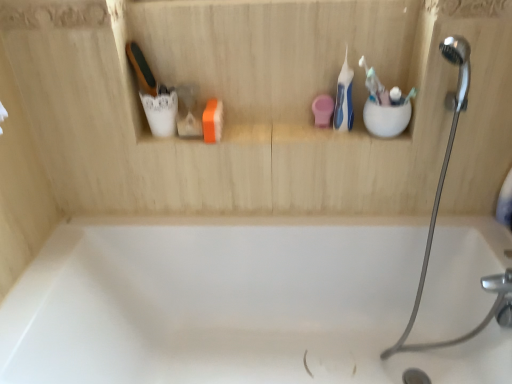
Image resolution: width=512 pixels, height=384 pixels. What are the coordinates of `blank space to the left of blue plastic toothbrush at upper right, arranged as the 3th toothbrush when viewed from the right` in the screenshot? It's located at (297, 138).